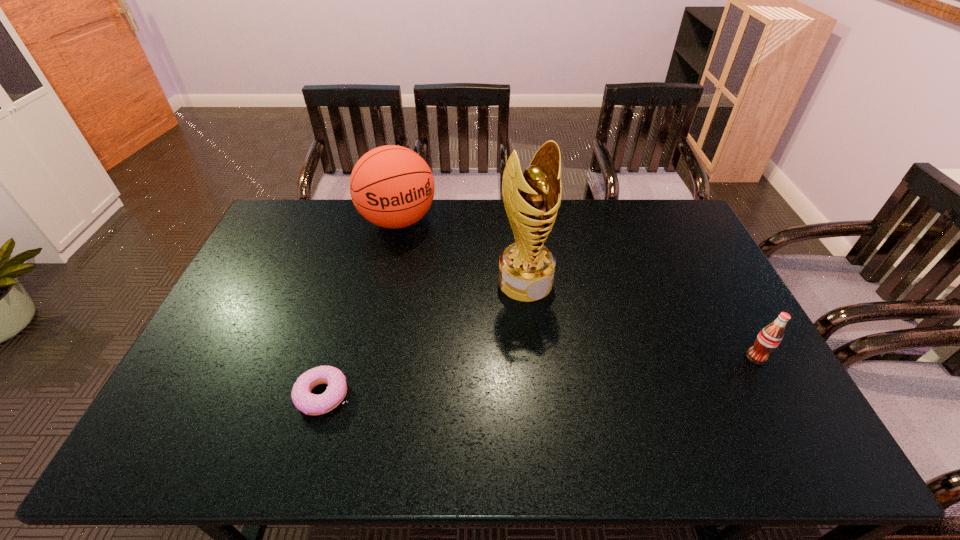
In the image, there is a desktop. What are the coordinates of `vacant space at the near edge` in the screenshot? It's located at (496, 400).

Where is `vacant space at the left edge`? The width and height of the screenshot is (960, 540). vacant space at the left edge is located at coordinates (236, 294).

What are the coordinates of `vacant space at the right edge of the desktop` in the screenshot? It's located at (744, 328).

Locate an element on the screen. The width and height of the screenshot is (960, 540). vacant space at the far left corner is located at coordinates (285, 213).

You are a GUI agent. You are given a task and a screenshot of the screen. Output one action in this format:
    pyautogui.click(x=<x>, y=<y>)
    Task: Click on the vacant area between the doughnut and the third nearest object
    The height and width of the screenshot is (540, 960).
    Given the screenshot: What is the action you would take?
    pyautogui.click(x=424, y=339)

Where is `free space that is in between the shortest object and the third tallest object`? The image size is (960, 540). free space that is in between the shortest object and the third tallest object is located at coordinates (540, 376).

You are a GUI agent. You are given a task and a screenshot of the screen. Output one action in this format:
    pyautogui.click(x=<x>, y=<y>)
    Task: Click on the free space between the nearest object and the tallest object
    
    Given the screenshot: What is the action you would take?
    pyautogui.click(x=424, y=339)

Identify the location of empty location between the doughnut and the third shortest object. The image size is (960, 540). (360, 308).

Where is `free space that is in between the second shortest object and the award`? Image resolution: width=960 pixels, height=540 pixels. free space that is in between the second shortest object and the award is located at coordinates (640, 320).

Locate an element on the screen. empty space between the doughnut and the basketball is located at coordinates (360, 308).